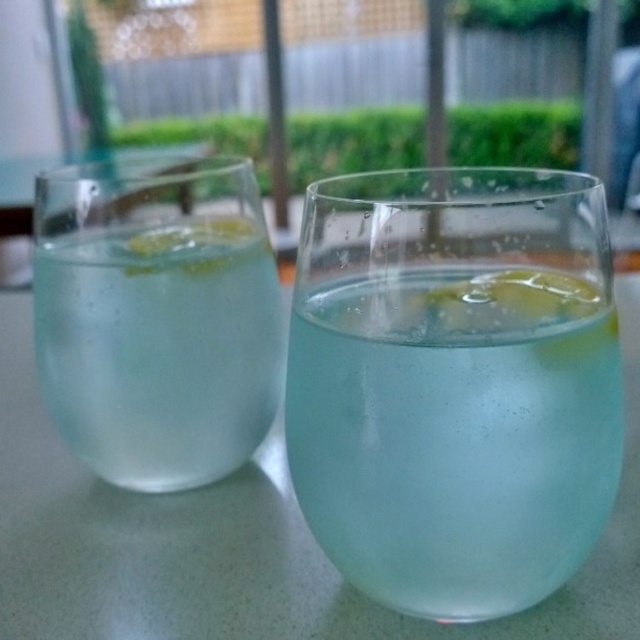
You have a small coaster that is 3.5 inches wide. You want to place it between the transparent glass at center and the clear glass at left. Will the coaster fit snugly between them without overlapping either glass?

The transparent glass at center and clear glass at left are 4.01 inches apart from each other. Since the coaster is 3.5 inches wide, it will fit snugly between them with a small gap remaining.

You are setting up a picnic table and need to arrange two clear glasses. You have the clear glass at center and the clear glass at left. If you want to place them so that one is closer to you than the other, which glass should you position closer?

You should position the clear glass at center closer to you because it is in front of the clear glass at left.